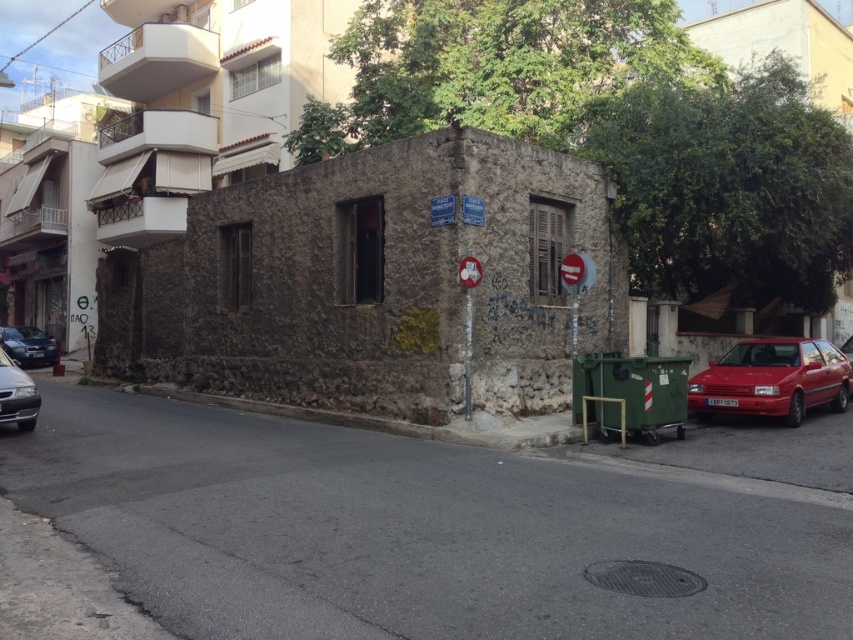
You are a delivery person trying to park your truck between the shiny red car at right and the shiny silver sedan at lower left. Your truck is 2.5 meters wide. Can you fit your truck in the space between them?

The shiny red car at right might be wider than shiny silver sedan at lower left. Since the exact width isn t specified, it s uncertain if the space between them is wide enough for a 2.5 meter truck. Check the actual dimensions before deciding.

You are a delivery driver who needs to park your vehicle in this area. You have a shiny silver sedan at lower left and a shiny black sedan at left. The parking space you want to use is 20 meters long. Can both vehicles fit side by side in this space?

The shiny silver sedan at lower left is 19.79 meters from shiny black sedan at left, so yes, both vehicles can fit side by side in the 20 meter parking space since the total length required is less than the available space.

You are standing at the point marked by point [16,394]. Looking towards the shiny silver sedan at lower left, which direction should you walk to reach the weathered stone building at the center?

Walk towards the weathered stone building at the center by moving to the right from point [16,394], as the shiny silver sedan at lower left is located to your left side.